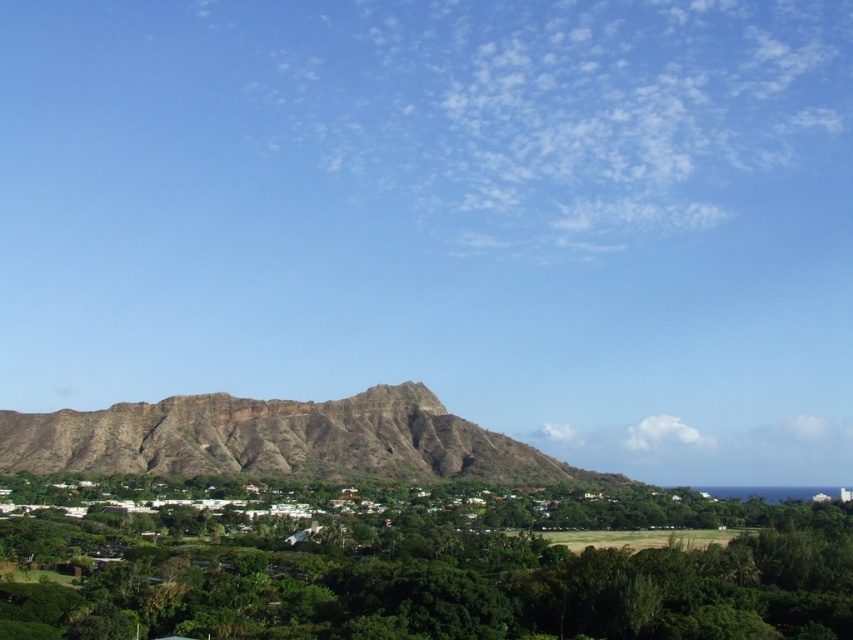
Does green leafy tree at lower center appear on the right side of brown rocky hillside at center?

Indeed, green leafy tree at lower center is positioned on the right side of brown rocky hillside at center.

Does point (848, 573) come in front of point (276, 433)?

Yes, point (848, 573) is closer to viewer.

Identify the location of green leafy tree at lower center. (415, 563).